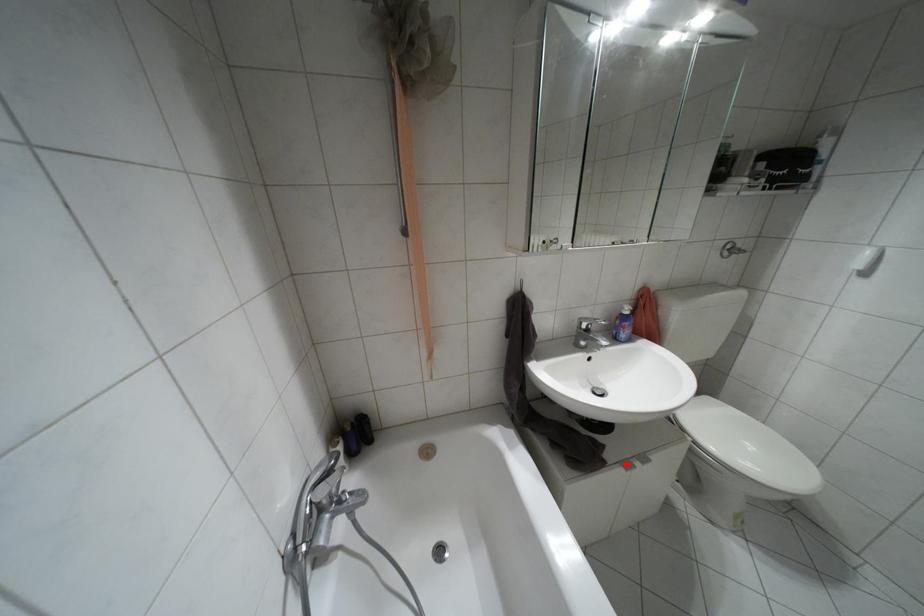
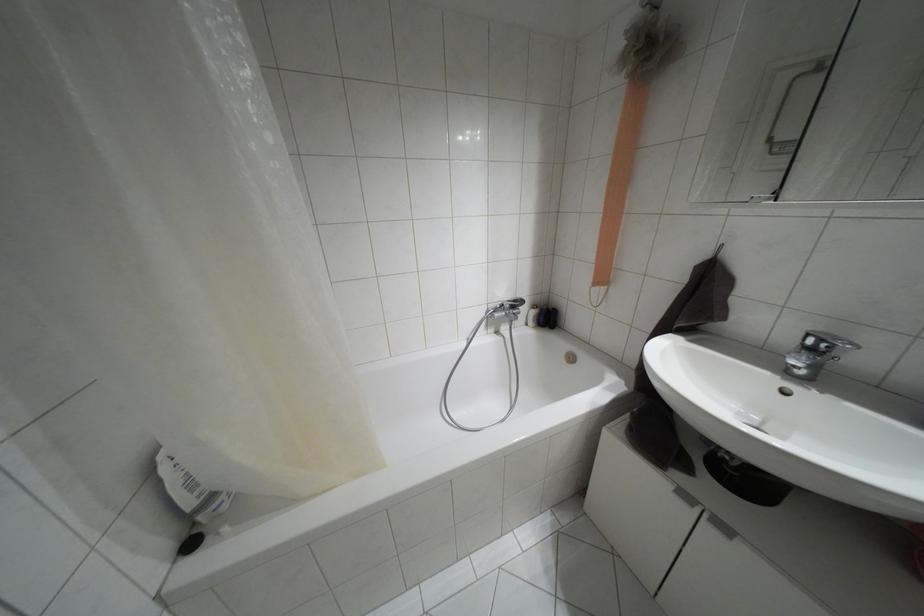
Where in the second image is the point corresponding to the highlighted location from the first image?

(685, 496)